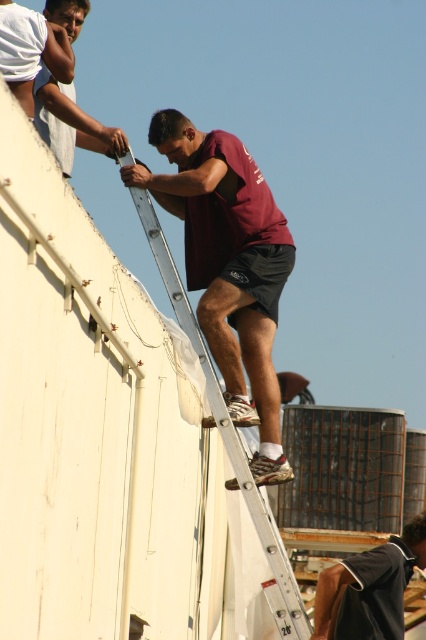
You are a safety inspector assessing the distance between the dark blue jersey at upper center and the matte white shirt at upper left on a large structure. The safety protocol requires a minimum distance of 25 meters between workers for safety. Is the current distance compliant with the protocol?

The dark blue jersey at upper center is 26.47 meters from the matte white shirt at upper left, which exceeds the required 25 meters, so the distance is compliant with the safety protocol.

You are a safety inspector evaluating the scene. You notice two workers wearing different colored shirts. The dark blue jersey at upper center and the matte white shirt at upper left. Which worker appears to be taking up less space in the image?

The dark blue jersey at upper center occupies less space than the matte white shirt at upper left, so the worker in the dark blue jersey at upper center is taking up less space.

You are standing at the base of the structure and want to reach the point marked at coordinates (x=276, y=589). The ladder is your only path. Given that the point is 70.96 meters away from you, can you estimate how many rungs you need to climb to reach it?

The point at (x=276, y=589) is 70.96 meters away from the viewer. Assuming an average ladder rung spacing of about 0.3 meters, you would need to climb approximately 236.5 rungs to reach it.